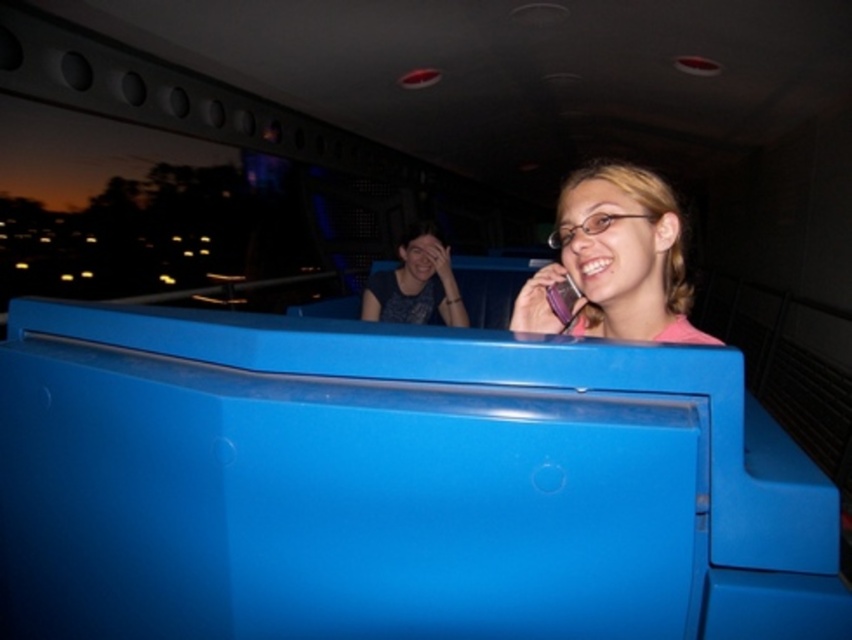
Question: Which point is closer to the camera?

Choices:
 (A) (446, 304)
 (B) (545, 291)
 (C) (620, 188)

Answer: (C)

Question: Is pink matte phone at upper right positioned before matte black shirt at center?

Choices:
 (A) yes
 (B) no

Answer: (A)

Question: Does matte black shirt at center lie in front of matte purple phone at upper right?

Choices:
 (A) no
 (B) yes

Answer: (A)

Question: Which of the following is the farthest from the observer?

Choices:
 (A) pink matte phone at upper right
 (B) matte black shirt at center

Answer: (B)

Question: Estimate the real-world distances between objects in this image. Which object is farther from the matte black shirt at center?

Choices:
 (A) matte purple phone at upper right
 (B) pink matte phone at upper right

Answer: (A)

Question: Does pink matte phone at upper right come in front of matte purple phone at upper right?

Choices:
 (A) no
 (B) yes

Answer: (B)